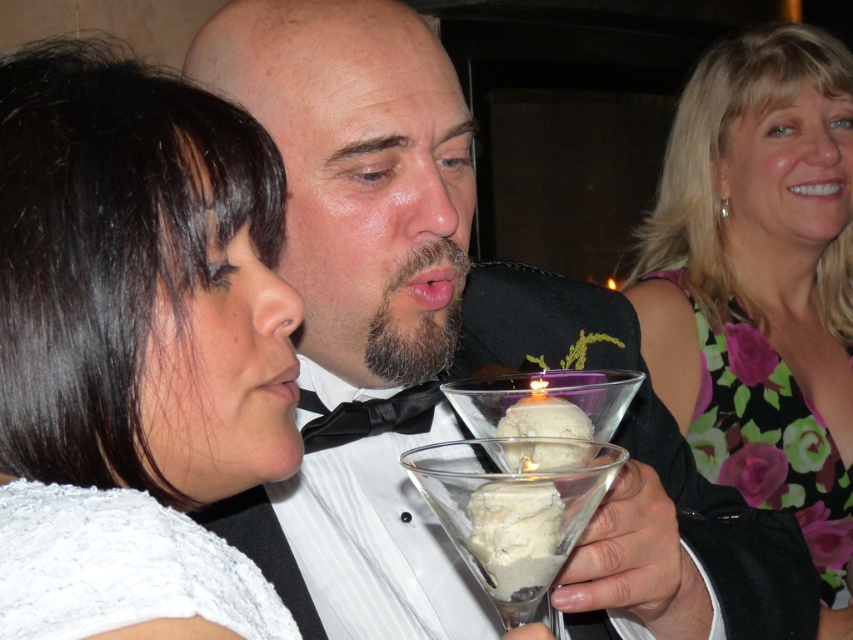
Question: Does clear glass martini glass at center appear over white creamy ice cream at center?

Choices:
 (A) no
 (B) yes

Answer: (B)

Question: Which of these objects is positioned closest to the white creamy ice cream at center?

Choices:
 (A) floral fabric dress at upper right
 (B) black satin bow tie at center
 (C) clear glass martini glass at center

Answer: (C)

Question: Does white lace at left appear on the right side of white creamy ice cream at center?

Choices:
 (A) yes
 (B) no

Answer: (B)

Question: Does floral fabric dress at upper right have a greater width compared to clear glass martini glass at center?

Choices:
 (A) no
 (B) yes

Answer: (B)

Question: Which is farther from the floral fabric dress at upper right?

Choices:
 (A) white lace at left
 (B) black satin bow tie at center

Answer: (A)

Question: Which object appears farthest from the camera in this image?

Choices:
 (A) white lace at left
 (B) floral fabric dress at upper right
 (C) white creamy ice cream at center

Answer: (B)